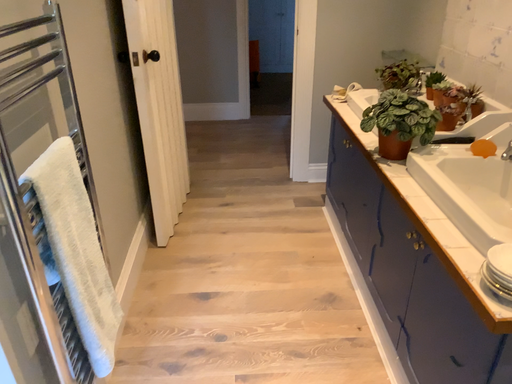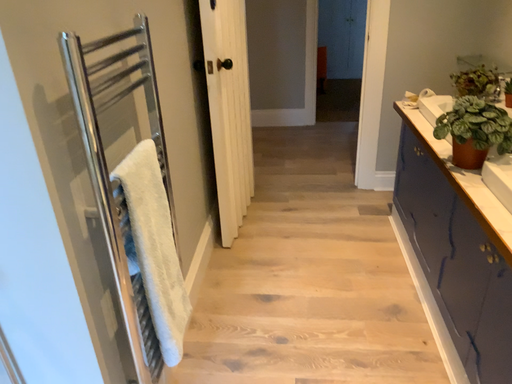
Question: Which way did the camera rotate in the video?

Choices:
 (A) rotated right
 (B) rotated left

Answer: (B)